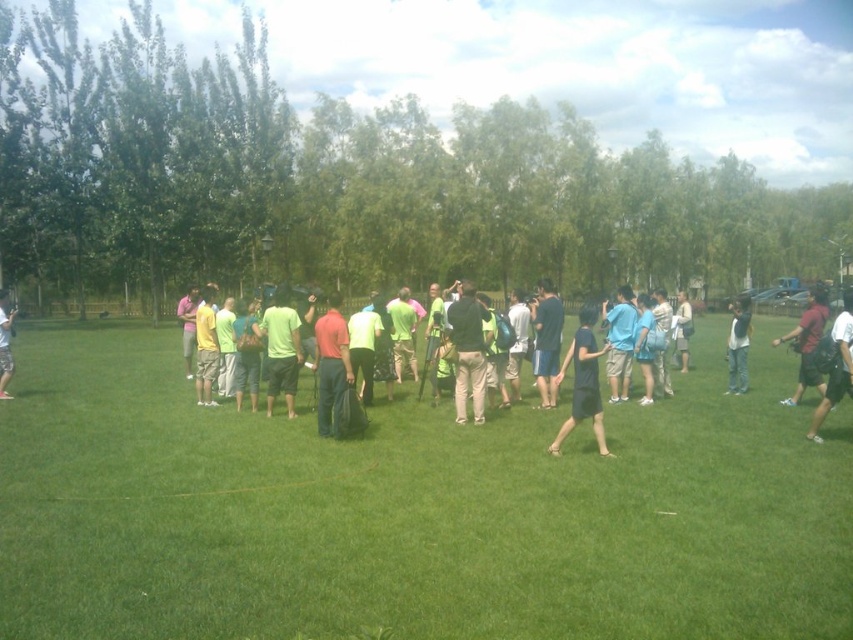
Does red shirt at center lie behind green matte shirt at center?

No.

Is point (328, 362) more distant than point (280, 308)?

No, it is not.

At what (x,y) coordinates should I click in order to perform the action: click on red shirt at center. Please return your answer as a coordinate pair (x, y). This screenshot has width=853, height=640. Looking at the image, I should click on (331, 364).

Is dark gray fabric jacket at center shorter than blue fabric shirt at center?

Incorrect, dark gray fabric jacket at center's height does not fall short of blue fabric shirt at center's.

Based on the photo, is dark gray fabric jacket at center to the left of blue fabric shirt at center from the viewer's perspective?

Yes, dark gray fabric jacket at center is to the left of blue fabric shirt at center.

Is point (463, 417) positioned before point (648, 348)?

Yes, it is.

What are the coordinates of `dark gray fabric jacket at center` in the screenshot? It's located at (467, 353).

From the picture: Is green grass at center bigger than green matte shirt at center?

Correct, green grass at center is larger in size than green matte shirt at center.

What do you see at coordinates (412, 513) in the screenshot?
I see `green grass at center` at bounding box center [412, 513].

Where is `green grass at center`? Image resolution: width=853 pixels, height=640 pixels. green grass at center is located at coordinates (412, 513).